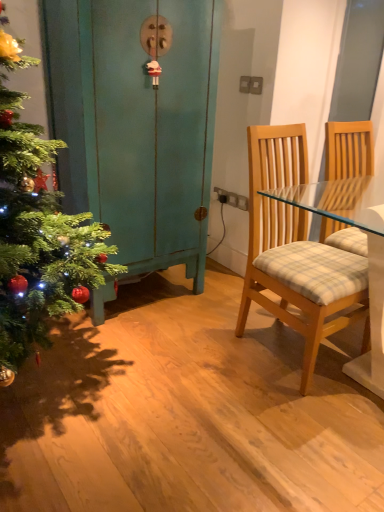
Question: In terms of height, does light wood/glass chair at right look taller or shorter compared to teal painted wood dresser at left?

Choices:
 (A) short
 (B) tall

Answer: (A)

Question: In terms of width, does light wood/glass chair at right look wider or thinner when compared to teal painted wood dresser at left?

Choices:
 (A) thin
 (B) wide

Answer: (B)

Question: Visually, is light wood/glass chair at right positioned to the left or to the right of teal painted wood dresser at left?

Choices:
 (A) left
 (B) right

Answer: (B)

Question: In terms of height, does teal painted wood dresser at left look taller or shorter compared to light wood/glass chair at right?

Choices:
 (A) short
 (B) tall

Answer: (B)

Question: In terms of width, does teal painted wood dresser at left look wider or thinner when compared to light wood/glass chair at right?

Choices:
 (A) wide
 (B) thin

Answer: (B)

Question: Considering the positions of teal painted wood dresser at left and light wood/glass chair at right in the image, is teal painted wood dresser at left bigger or smaller than light wood/glass chair at right?

Choices:
 (A) small
 (B) big

Answer: (B)

Question: From a real-world perspective, is teal painted wood dresser at left positioned above or below light wood/glass chair at right?

Choices:
 (A) above
 (B) below

Answer: (A)